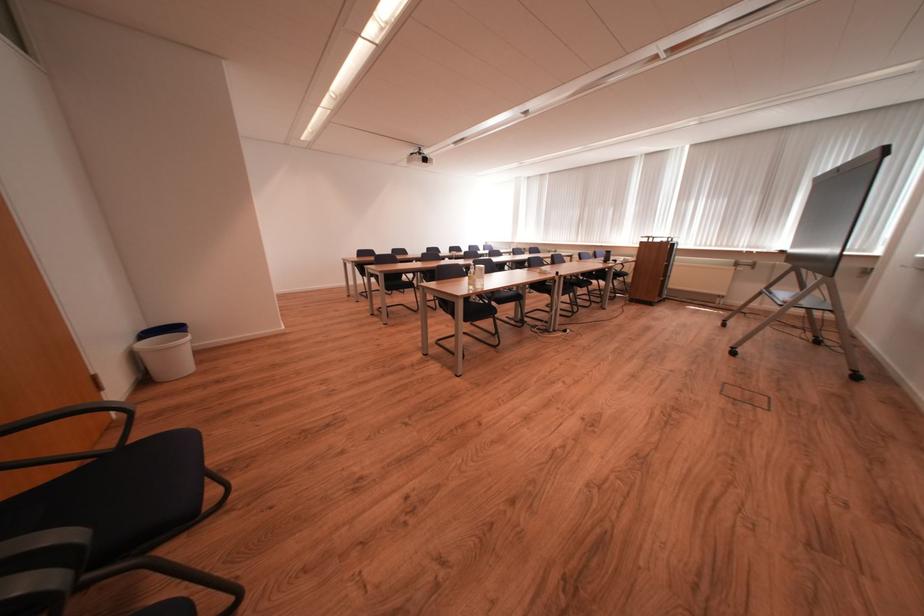
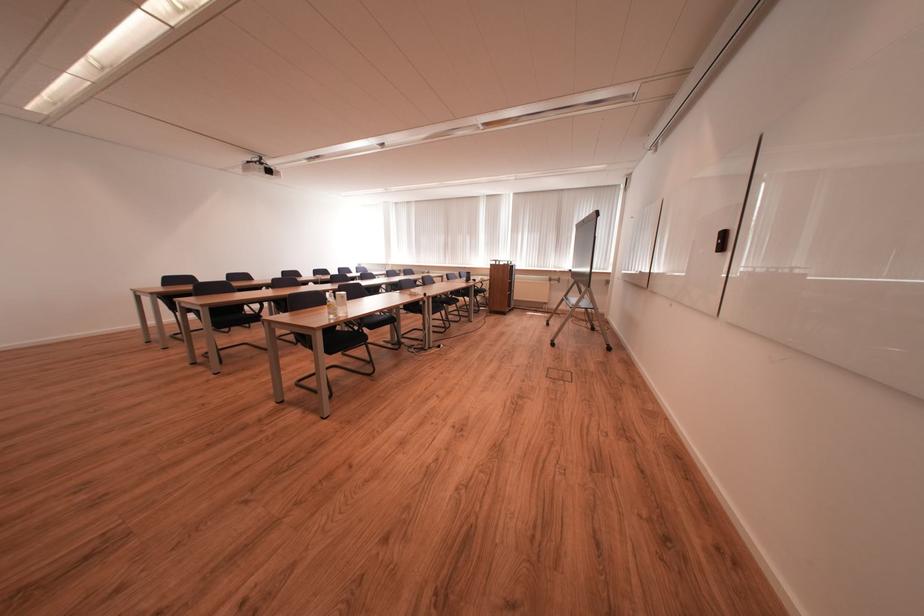
Where in the second image is the point corresponding to (x=433, y=161) from the first image?

(277, 174)